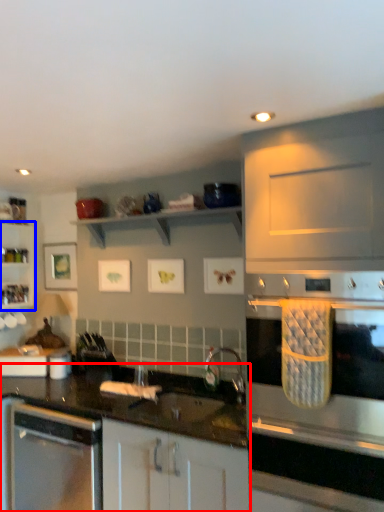
Question: Which object appears closest to the camera in this image, countertop (highlighted by a red box) or shelf (highlighted by a blue box)?

Choices:
 (A) countertop
 (B) shelf

Answer: (A)